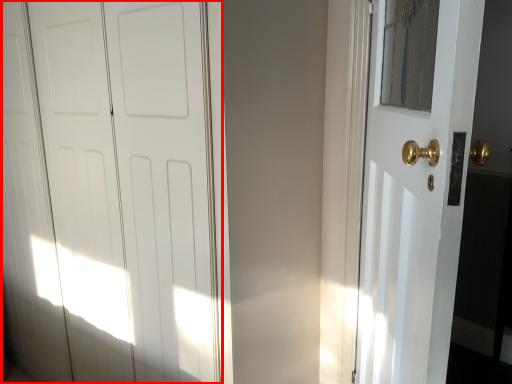
Question: From the image's perspective, what is the correct spatial positioning of door (annotated by the red box) in reference to door?

Choices:
 (A) above
 (B) below

Answer: (A)